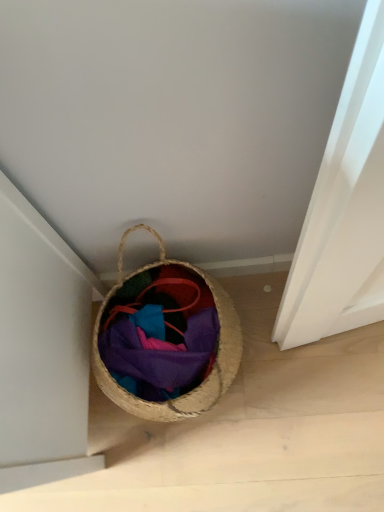
Question: Should I look upward or downward to see matte woven basket at center?

Choices:
 (A) up
 (B) down

Answer: (B)

Question: Considering the relative positions of matte woven basket at center and braided straw basket at lower center in the image provided, is matte woven basket at center to the right of braided straw basket at lower center from the viewer's perspective?

Choices:
 (A) no
 (B) yes

Answer: (B)

Question: Is matte woven basket at center oriented towards braided straw basket at lower center?

Choices:
 (A) yes
 (B) no

Answer: (A)

Question: Does matte woven basket at center have a greater width compared to braided straw basket at lower center?

Choices:
 (A) no
 (B) yes

Answer: (A)

Question: Is matte woven basket at center facing away from braided straw basket at lower center?

Choices:
 (A) no
 (B) yes

Answer: (B)

Question: Is matte woven basket at center far from braided straw basket at lower center?

Choices:
 (A) no
 (B) yes

Answer: (A)

Question: From the image's perspective, is matte woven basket at center on top of braided straw basket at lower center?

Choices:
 (A) no
 (B) yes

Answer: (A)

Question: Is braided straw basket at lower center bigger than matte woven basket at center?

Choices:
 (A) no
 (B) yes

Answer: (B)

Question: Would you say braided straw basket at lower center contains matte woven basket at center?

Choices:
 (A) no
 (B) yes

Answer: (B)

Question: Does braided straw basket at lower center have a greater height compared to matte woven basket at center?

Choices:
 (A) no
 (B) yes

Answer: (B)

Question: Would you consider braided straw basket at lower center to be distant from matte woven basket at center?

Choices:
 (A) no
 (B) yes

Answer: (A)

Question: From a real-world perspective, is braided straw basket at lower center positioned over matte woven basket at center based on gravity?

Choices:
 (A) yes
 (B) no

Answer: (A)

Question: Is braided straw basket at lower center aimed at matte woven basket at center?

Choices:
 (A) yes
 (B) no

Answer: (A)

Question: In terms of width, does matte woven basket at center look wider or thinner when compared to braided straw basket at lower center?

Choices:
 (A) wide
 (B) thin

Answer: (B)